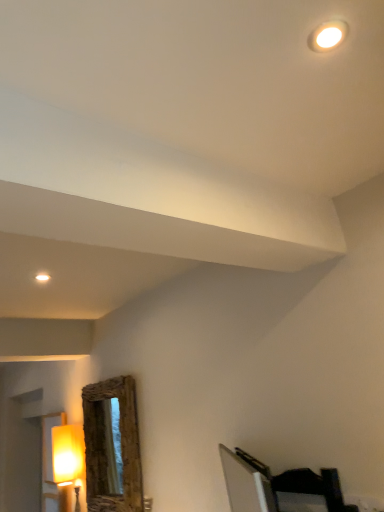
The height and width of the screenshot is (512, 384). Identify the location of rustic wood mirror at lower left. pos(107,446).

Describe the element at coordinates (107, 446) in the screenshot. I see `rustic wood mirror at lower left` at that location.

The height and width of the screenshot is (512, 384). What are the coordinates of `matte yellow lampshade at left` in the screenshot? It's located at (68, 461).

I want to click on rustic wood mirror at lower left, so click(107, 446).

How many degrees apart are the facing directions of matte yellow lampshade at left and dark wood bed at lower right?

5.4 degrees.

Which is more to the left, matte yellow lampshade at left or dark wood bed at lower right?

Positioned to the left is matte yellow lampshade at left.

Can you confirm if matte yellow lampshade at left is smaller than dark wood bed at lower right?

Incorrect, matte yellow lampshade at left is not smaller in size than dark wood bed at lower right.

From a real-world perspective, between matte yellow lampshade at left and dark wood bed at lower right, who is vertically higher?

matte yellow lampshade at left is physically above.

Is dark wood bed at lower right outside of rustic wood mirror at lower left?

Yes.

Considering the relative sizes of dark wood bed at lower right and rustic wood mirror at lower left in the image provided, is dark wood bed at lower right wider than rustic wood mirror at lower left?

Incorrect, the width of dark wood bed at lower right does not surpass that of rustic wood mirror at lower left.

Is rustic wood mirror at lower left at the back of dark wood bed at lower right?

No, dark wood bed at lower right is not facing the opposite direction of rustic wood mirror at lower left.

From a real-world perspective, between dark wood bed at lower right and rustic wood mirror at lower left, who is vertically higher?

In real-world perspective, rustic wood mirror at lower left is above.

In the image, is rustic wood mirror at lower left on the left side or the right side of dark wood bed at lower right?

rustic wood mirror at lower left is to the left of dark wood bed at lower right.

Which of these two, rustic wood mirror at lower left or dark wood bed at lower right, stands taller?

rustic wood mirror at lower left is taller.

Is point (126, 462) in front of point (296, 508)?

No.

Is rustic wood mirror at lower left aimed at dark wood bed at lower right?

No, rustic wood mirror at lower left is not oriented towards dark wood bed at lower right.

Are matte yellow lampshade at left and rustic wood mirror at lower left far apart?

No, matte yellow lampshade at left is in close proximity to rustic wood mirror at lower left.

Between matte yellow lampshade at left and rustic wood mirror at lower left, which one appears on the left side from the viewer's perspective?

matte yellow lampshade at left is more to the left.

This screenshot has width=384, height=512. Identify the location of mirror above the matte yellow lampshade at left (from the image's perspective). (107, 446).

Looking at this image, from a real-world perspective, who is located higher, rustic wood mirror at lower left or matte yellow lampshade at left?

From a 3D spatial view, rustic wood mirror at lower left is above.

Is rustic wood mirror at lower left aimed at matte yellow lampshade at left?

No, rustic wood mirror at lower left is not turned towards matte yellow lampshade at left.

Considering their positions, is rustic wood mirror at lower left located in front of or behind matte yellow lampshade at left?

rustic wood mirror at lower left is in front of matte yellow lampshade at left.

Which is more to the right, rustic wood mirror at lower left or matte yellow lampshade at left?

From the viewer's perspective, rustic wood mirror at lower left appears more on the right side.

Is matte yellow lampshade at left located within dark wood bed at lower right?

Definitely not — matte yellow lampshade at left is not inside dark wood bed at lower right.

Considering the sizes of dark wood bed at lower right and matte yellow lampshade at left in the image, is dark wood bed at lower right bigger or smaller than matte yellow lampshade at left?

Clearly, dark wood bed at lower right is smaller in size than matte yellow lampshade at left.

Consider the image. Who is shorter, dark wood bed at lower right or matte yellow lampshade at left?

Standing shorter between the two is dark wood bed at lower right.

Based on the photo, measure the distance between dark wood bed at lower right and matte yellow lampshade at left.

dark wood bed at lower right and matte yellow lampshade at left are 1.65 meters apart.

Identify the location of furniture to the right of matte yellow lampshade at left. The image size is (384, 512). (278, 487).

At what (x,y) coordinates should I click in order to perform the action: click on mirror above the dark wood bed at lower right (from a real-world perspective). Please return your answer as a coordinate pair (x, y). Looking at the image, I should click on (107, 446).

Looking at the image, which one is located closer to dark wood bed at lower right, matte yellow lampshade at left or rustic wood mirror at lower left?

rustic wood mirror at lower left is positioned closer to the anchor dark wood bed at lower right.

When comparing their distances from matte yellow lampshade at left, does rustic wood mirror at lower left or dark wood bed at lower right seem closer?

rustic wood mirror at lower left is closer to matte yellow lampshade at left.

Which object lies nearer to the anchor point rustic wood mirror at lower left, matte yellow lampshade at left or dark wood bed at lower right?

matte yellow lampshade at left is positioned closer to the anchor rustic wood mirror at lower left.

Estimate the real-world distances between objects in this image. Which object is further from rustic wood mirror at lower left, dark wood bed at lower right or matte yellow lampshade at left?

dark wood bed at lower right is further to rustic wood mirror at lower left.

Looking at the image, which one is located closer to dark wood bed at lower right, rustic wood mirror at lower left or matte yellow lampshade at left?

The object closer to dark wood bed at lower right is rustic wood mirror at lower left.

Based on the photo, estimate the real-world distances between objects in this image. Which object is further from matte yellow lampshade at left, dark wood bed at lower right or rustic wood mirror at lower left?

dark wood bed at lower right is positioned further to the anchor matte yellow lampshade at left.

Find the location of `mirror situated between matte yellow lampshade at left and dark wood bed at lower right from left to right`. mirror situated between matte yellow lampshade at left and dark wood bed at lower right from left to right is located at coordinates (107, 446).